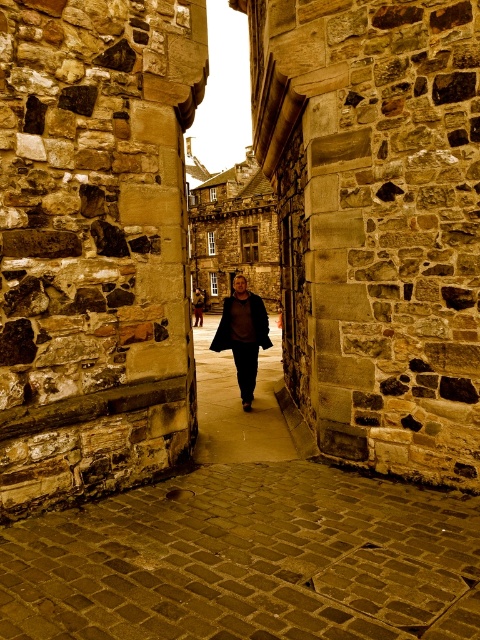
You are a delivery person carrying a package that requires a 12 meter distance between two objects to pass through safely. You see the dark brown leather jacket at center and the matte brown coat at center in the alleyway. Can you safely pass through the space between them?

The dark brown leather jacket at center is 13.12 meters from the matte brown coat at center. Since the required distance for the package is 12 meters, the 13.12 meters distance is sufficient, so you can safely pass through the space between them.

You are standing in a historical alleyway and see a person wearing a dark brown leather jacket at center. Where exactly is the dark brown leather jacket located in the image?

The dark brown leather jacket at center is located at point coordinates of (238, 404).